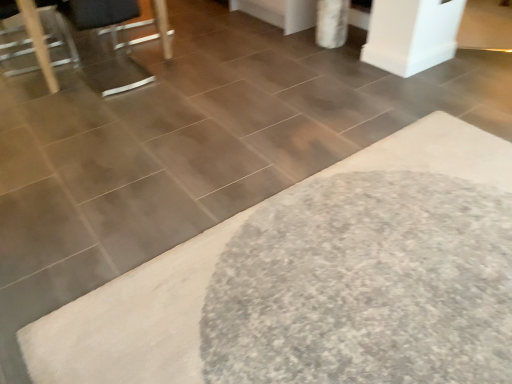
Question: Would you say white shaggy bath mat at lower right contains metallic silver chair at left?

Choices:
 (A) no
 (B) yes

Answer: (A)

Question: From the image's perspective, is white shaggy bath mat at lower right beneath metallic silver chair at left?

Choices:
 (A) yes
 (B) no

Answer: (A)

Question: Can you confirm if white shaggy bath mat at lower right is thinner than metallic silver chair at left?

Choices:
 (A) no
 (B) yes

Answer: (A)

Question: Can you confirm if white shaggy bath mat at lower right is bigger than metallic silver chair at left?

Choices:
 (A) no
 (B) yes

Answer: (B)

Question: Considering the relative positions of white shaggy bath mat at lower right and metallic silver chair at left in the image provided, is white shaggy bath mat at lower right behind metallic silver chair at left?

Choices:
 (A) no
 (B) yes

Answer: (A)

Question: Is white shaggy bath mat at lower right bigger or smaller than metallic silver swivel chair at upper left?

Choices:
 (A) small
 (B) big

Answer: (B)

Question: Considering the positions of point (86, 339) and point (118, 11), is point (86, 339) closer or farther from the camera than point (118, 11)?

Choices:
 (A) farther
 (B) closer

Answer: (B)

Question: In the image, is white shaggy bath mat at lower right positioned in front of or behind metallic silver swivel chair at upper left?

Choices:
 (A) behind
 (B) front

Answer: (B)

Question: Is white shaggy bath mat at lower right wider or thinner than metallic silver swivel chair at upper left?

Choices:
 (A) wide
 (B) thin

Answer: (A)

Question: From the image's perspective, is metallic silver chair at left above or below metallic silver swivel chair at upper left?

Choices:
 (A) below
 (B) above

Answer: (B)

Question: In the image, is metallic silver chair at left on the left side or the right side of metallic silver swivel chair at upper left?

Choices:
 (A) left
 (B) right

Answer: (A)

Question: Is metallic silver chair at left inside the boundaries of metallic silver swivel chair at upper left, or outside?

Choices:
 (A) inside
 (B) outside

Answer: (B)

Question: Is metallic silver chair at left taller or shorter than metallic silver swivel chair at upper left?

Choices:
 (A) tall
 (B) short

Answer: (B)

Question: Would you say metallic silver swivel chair at upper left is to the left or to the right of metallic silver chair at left in the picture?

Choices:
 (A) right
 (B) left

Answer: (A)

Question: From a real-world perspective, is metallic silver swivel chair at upper left physically located above or below metallic silver chair at left?

Choices:
 (A) below
 (B) above

Answer: (B)